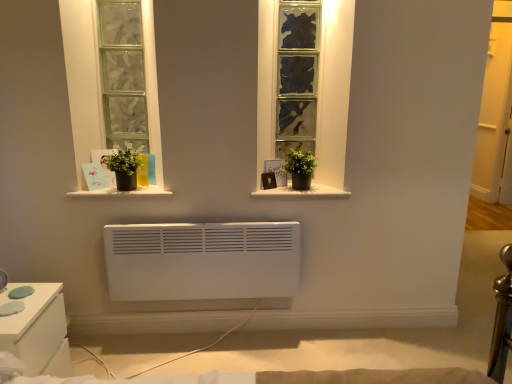
Locate an element on the screen. This screenshot has width=512, height=384. free space above white glossy nightstand at lower left (from a real-world perspective) is located at coordinates (18, 303).